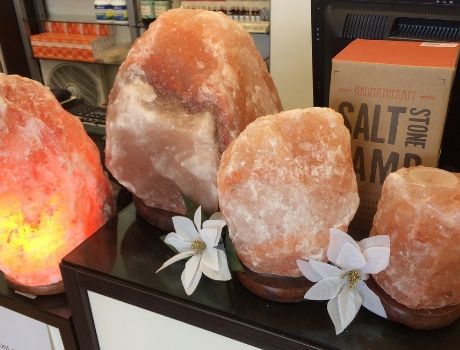
I want to click on fan, so click(x=74, y=72).